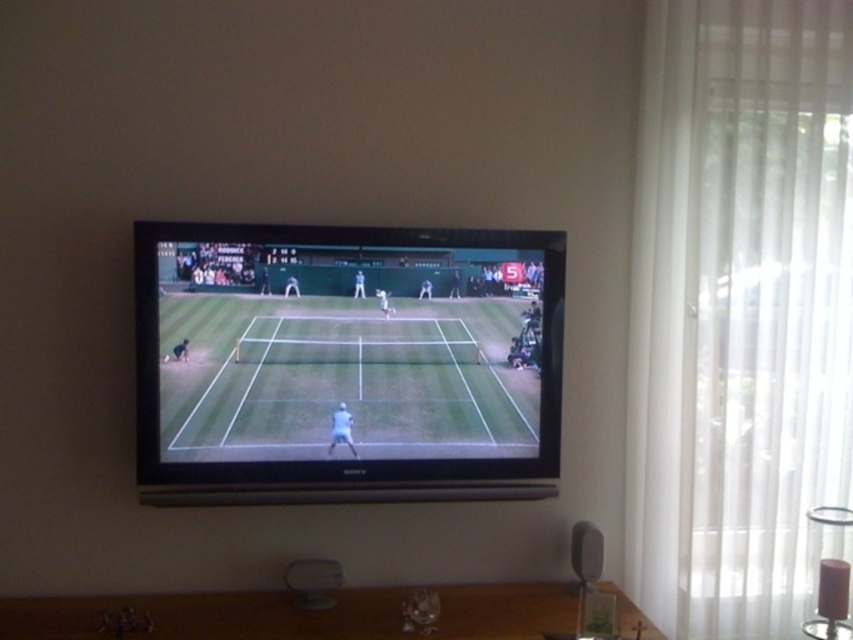
You are a guest in the living room and want to place your drink on the brown wooden table at lower center. However, there is a white sheer curtain at right in the way. Can you move around the curtain to reach the table?

The brown wooden table at lower center is behind the white sheer curtain at right, so you can move around the curtain to access the table.

You are sitting on a sofa in the living room and want to place a book on the brown wooden table at lower center. However, you notice the white sheer curtain at right might be in the way. Can you place the book on the table without moving the curtain?

The white sheer curtain at right is positioned over the brown wooden table at lower center, so you cannot place the book directly on the table without moving the curtain as it is covering part of the table.

You are a photographer standing in the living room and want to take a photo of the green grass tennis court at center displayed on the TV. If your camera has a maximum focus distance of 6 feet, will it be able to capture the tennis court clearly?

The green grass tennis court at center and camera are 6.33 feet apart, which exceeds the camera maximum focus distance of 6 feet. Therefore, the camera cannot capture the tennis court clearly.